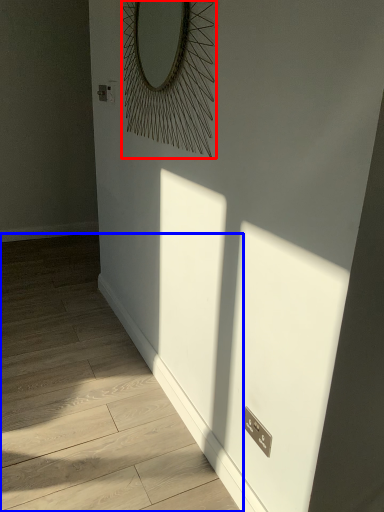
Question: Which of the following is the farthest to the observer, mirror (highlighted by a red box) or corridor (highlighted by a blue box)?

Choices:
 (A) mirror
 (B) corridor

Answer: (A)